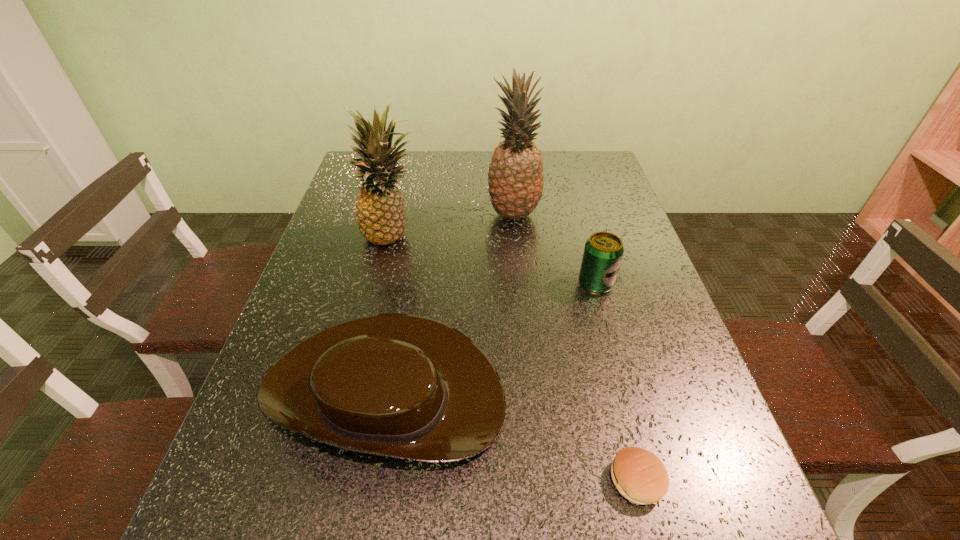
You are a GUI agent. You are given a task and a screenshot of the screen. Output one action in this format:
    pyautogui.click(x=<x>, y=<y>)
    Task: Click on the vacant space at the near right corner of the desktop
    
    Given the screenshot: What is the action you would take?
    pyautogui.click(x=730, y=528)

I want to click on empty space between the left pineapple and the shortest object, so click(515, 357).

Find the location of a particular element. The width and height of the screenshot is (960, 540). vacant area between the right pineapple and the shortest object is located at coordinates (575, 347).

I want to click on vacant space in between the right pineapple and the beer can, so (x=555, y=249).

The height and width of the screenshot is (540, 960). In order to click on blank region between the cowboy hat and the right pineapple in this screenshot , I will do `click(449, 301)`.

Locate an element on the screen. free space between the beer can and the left pineapple is located at coordinates (494, 259).

You are a GUI agent. You are given a task and a screenshot of the screen. Output one action in this format:
    pyautogui.click(x=<x>, y=<y>)
    Task: Click on the vacant point located between the beer can and the patty
    The width and height of the screenshot is (960, 540).
    Given the screenshot: What is the action you would take?
    pyautogui.click(x=616, y=382)

At what (x,y) coordinates should I click in order to perform the action: click on free space between the fourth tallest object and the left pineapple. Please return your answer as a coordinate pair (x, y). The width and height of the screenshot is (960, 540). Looking at the image, I should click on click(x=389, y=311).

Where is `free spot between the cowboy hat and the left pineapple`? This screenshot has width=960, height=540. free spot between the cowboy hat and the left pineapple is located at coordinates click(x=389, y=311).

At what (x,y) coordinates should I click in order to perform the action: click on free space between the left pineapple and the second shortest object. Please return your answer as a coordinate pair (x, y). The width and height of the screenshot is (960, 540). Looking at the image, I should click on 389,311.